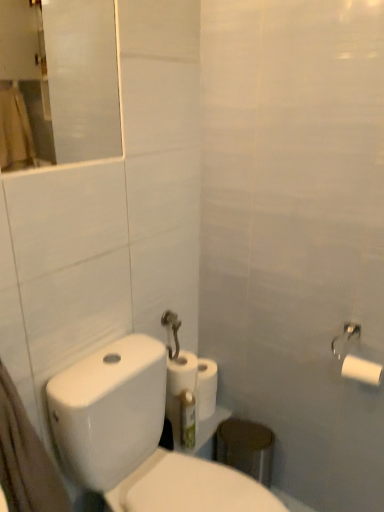
Question: Does white glossy toilet at lower left appear on the left side of transparent glass mirror at upper left?

Choices:
 (A) yes
 (B) no

Answer: (B)

Question: Does white glossy toilet at lower left come in front of transparent glass mirror at upper left?

Choices:
 (A) yes
 (B) no

Answer: (A)

Question: Does white glossy toilet at lower left contain transparent glass mirror at upper left?

Choices:
 (A) no
 (B) yes

Answer: (A)

Question: Could you tell me if white glossy toilet at lower left is turned towards transparent glass mirror at upper left?

Choices:
 (A) no
 (B) yes

Answer: (A)

Question: From the image's perspective, is white glossy toilet at lower left beneath transparent glass mirror at upper left?

Choices:
 (A) yes
 (B) no

Answer: (A)

Question: From a real-world perspective, is white glossy toilet at lower left under transparent glass mirror at upper left?

Choices:
 (A) yes
 (B) no

Answer: (A)

Question: Does green plastic toothbrush at lower center have a lesser height compared to white matte toilet paper at right, placed as the 2th toilet paper when sorted from right to left?

Choices:
 (A) yes
 (B) no

Answer: (B)

Question: Is green plastic toothbrush at lower center oriented towards white matte toilet paper at right, positioned as the 3th toilet paper in back-to-front order?

Choices:
 (A) no
 (B) yes

Answer: (A)

Question: Is green plastic toothbrush at lower center wider than white matte toilet paper at right, which is counted as the 2th toilet paper, starting from the left?

Choices:
 (A) no
 (B) yes

Answer: (A)

Question: Is green plastic toothbrush at lower center closer to the viewer compared to white matte toilet paper at right, placed as the 2th toilet paper when sorted from right to left?

Choices:
 (A) yes
 (B) no

Answer: (B)

Question: From a real-world perspective, is green plastic toothbrush at lower center beneath white matte toilet paper at right, which is counted as the 2th toilet paper, starting from the left?

Choices:
 (A) yes
 (B) no

Answer: (A)

Question: From a real-world perspective, is green plastic toothbrush at lower center on white matte toilet paper at right, the first toilet paper viewed from the front?

Choices:
 (A) yes
 (B) no

Answer: (B)

Question: From a real-world perspective, is white matte paper towel at center positioned over white matte toilet paper at upper right, the third toilet paper from the left, based on gravity?

Choices:
 (A) no
 (B) yes

Answer: (A)